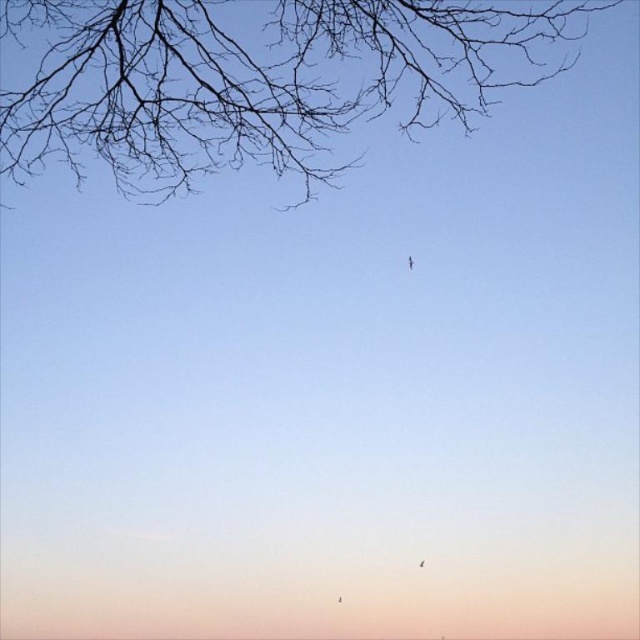
Question: Is brown branches at upper left above transparent plastic kite at center?

Choices:
 (A) no
 (B) yes

Answer: (B)

Question: Does brown branches at upper left have a greater width compared to transparent plastic kite at center?

Choices:
 (A) yes
 (B) no

Answer: (A)

Question: Is brown branches at upper left positioned in front of transparent plastic kite at center?

Choices:
 (A) yes
 (B) no

Answer: (A)

Question: Among these objects, which one is farthest from the camera?

Choices:
 (A) transparent plastic kite at center
 (B) brown branches at upper left

Answer: (A)